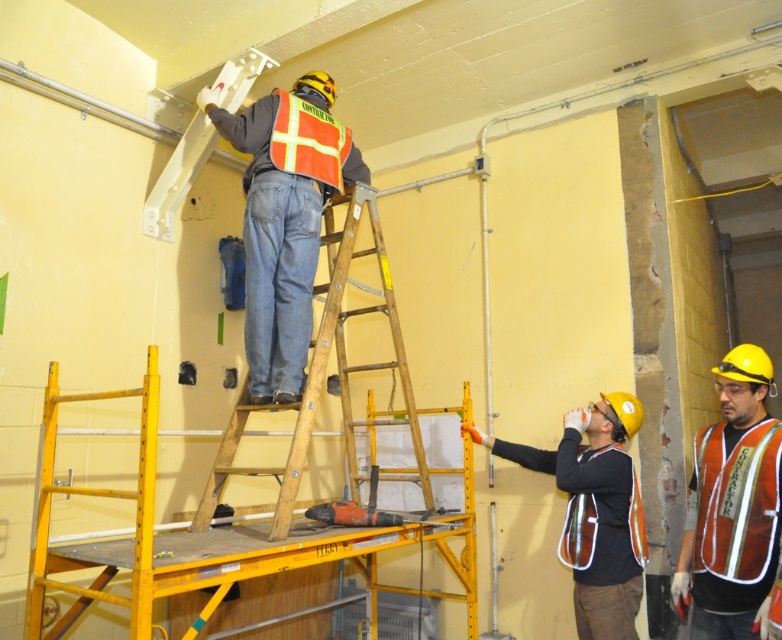
Question: Which point appears farthest from the camera in this image?

Choices:
 (A) (698, 504)
 (B) (280, 220)

Answer: (B)

Question: Can you confirm if reflective orange vest at upper center is bigger than orange reflective safety vest at lower right?

Choices:
 (A) no
 (B) yes

Answer: (B)

Question: Does wooden ladder at center appear under reflective orange safety vest at upper center?

Choices:
 (A) no
 (B) yes

Answer: (B)

Question: Which point is closer to the camera?

Choices:
 (A) (500, 452)
 (B) (339, 125)
 (C) (755, 467)
 (D) (336, 234)

Answer: (C)

Question: Considering the real-world distances, which object is closest to the wooden ladder at center?

Choices:
 (A) orange reflective safety vest at lower right
 (B) reflective orange vest at upper center

Answer: (B)

Question: Can you confirm if reflective orange vest at upper center is wider than orange reflective safety vest at lower right?

Choices:
 (A) yes
 (B) no

Answer: (A)